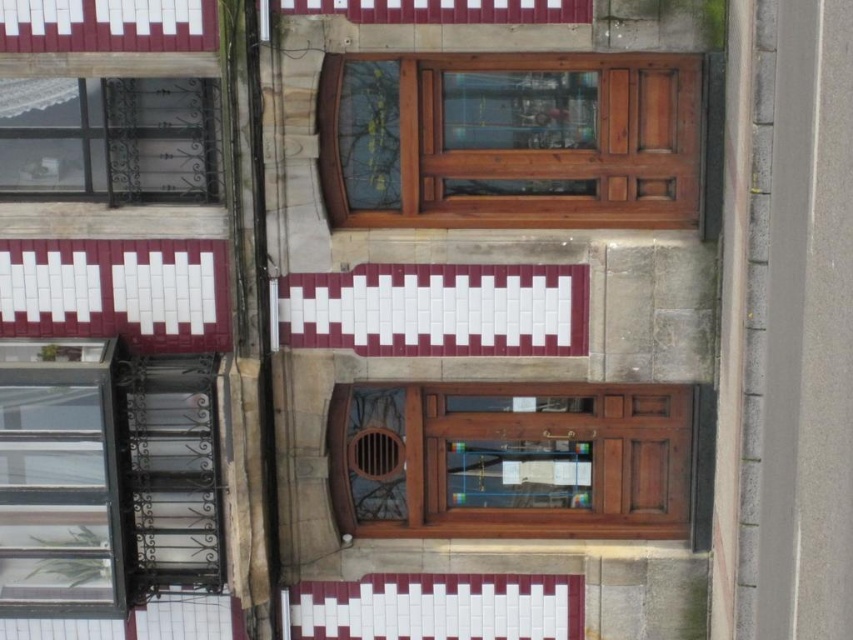
Question: Observing the image, what is the correct spatial positioning of mahogany wood window at center in reference to metallic wrought iron window at upper left?

Choices:
 (A) below
 (B) above

Answer: (A)

Question: Does wooden door at center appear over metallic wrought iron window at upper left?

Choices:
 (A) no
 (B) yes

Answer: (B)

Question: Estimate the real-world distances between objects in this image. Which object is closer to the mahogany wood window at center?

Choices:
 (A) clear glass window at lower left
 (B) metallic wrought iron window at upper left

Answer: (A)

Question: Which point appears farthest from the camera in this image?

Choices:
 (A) (56, 403)
 (B) (651, 220)
 (C) (3, 148)

Answer: (C)

Question: Which is farther from the wooden door at center?

Choices:
 (A) metallic wrought iron window at upper left
 (B) mahogany wood window at center

Answer: (B)

Question: Is wooden door at center positioned at the back of mahogany wood window at center?

Choices:
 (A) yes
 (B) no

Answer: (B)